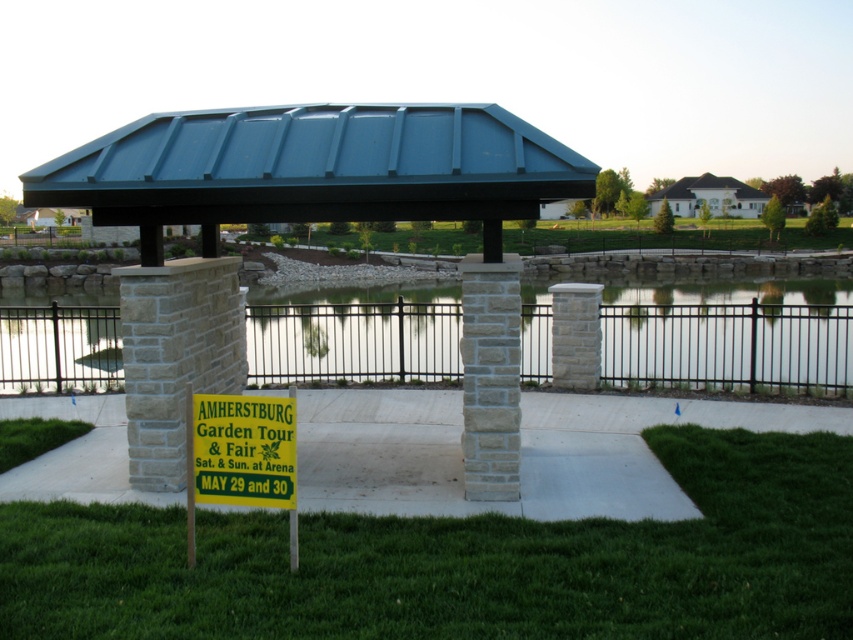
Question: Which of the following is the farthest from the observer?

Choices:
 (A) clear glass water at center
 (B) yellow paper sign at lower center

Answer: (A)

Question: In this image, where is green grass at lower center located relative to yellow paper sign at lower center?

Choices:
 (A) above
 (B) below

Answer: (B)

Question: Which object appears closest to the camera in this image?

Choices:
 (A) yellow paper sign at lower center
 (B) clear glass water at center

Answer: (A)

Question: Can you confirm if clear glass water at center is smaller than yellow paper sign at lower center?

Choices:
 (A) yes
 (B) no

Answer: (B)

Question: Which object is positioned closest to the yellow paper sign at lower center?

Choices:
 (A) metallic stone gazebo at center
 (B) clear glass water at center
 (C) green grass at lower center

Answer: (C)

Question: Considering the relative positions of green grass at lower center and yellow paper sign at lower center in the image provided, where is green grass at lower center located with respect to yellow paper sign at lower center?

Choices:
 (A) right
 (B) left

Answer: (A)